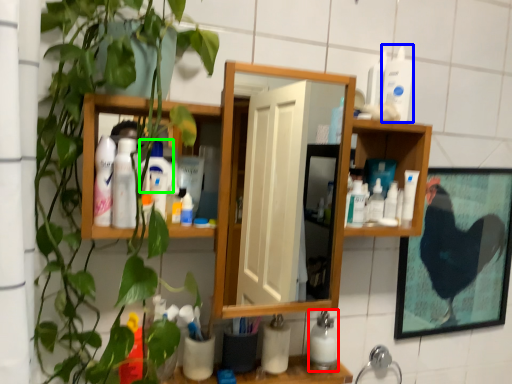
Question: Based on their relative distances, which object is farther from cleaning product (highlighted by a red box)? Choose from toiletry (highlighted by a blue box) and cleaning product (highlighted by a green box).

Choices:
 (A) toiletry
 (B) cleaning product

Answer: (A)